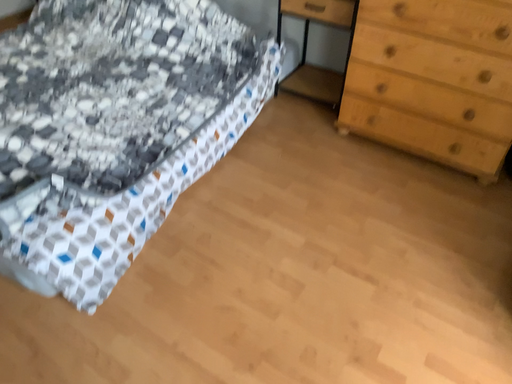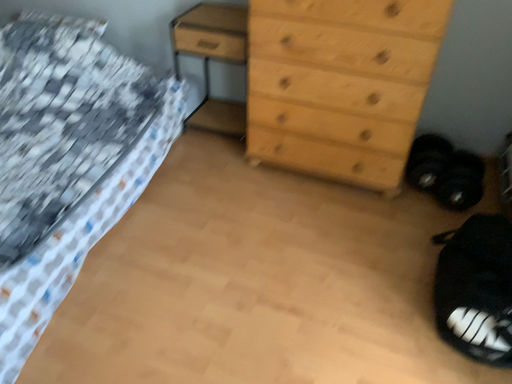
Question: How did the camera likely rotate when shooting the video?

Choices:
 (A) rotated left
 (B) rotated right

Answer: (B)